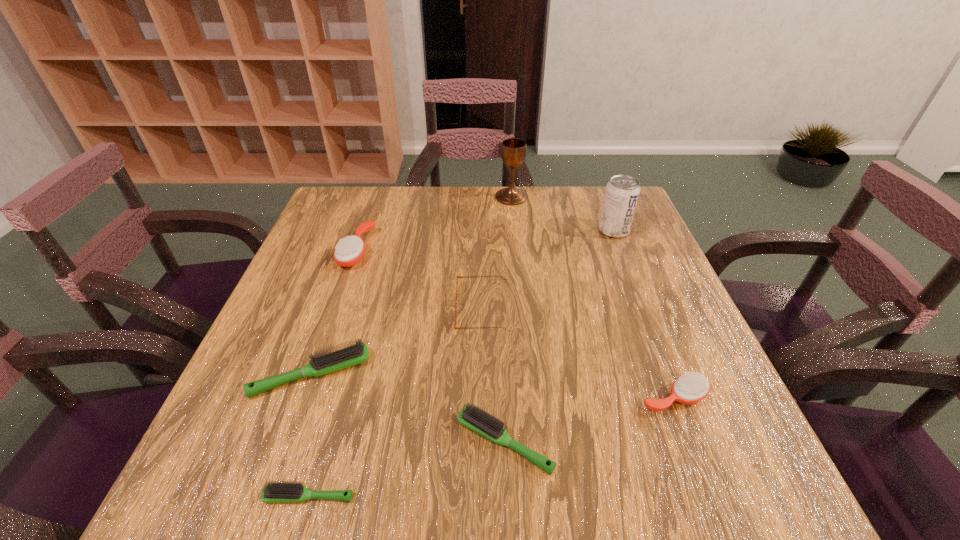
Locate an element on the screen. the farthest object is located at coordinates (513, 151).

At what (x,y) coordinates should I click in order to perform the action: click on the seventh shortest object. Please return your answer as a coordinate pair (x, y). This screenshot has width=960, height=540. Looking at the image, I should click on (622, 192).

Identify the location of the bigger orange hairbrush. (348, 251).

The image size is (960, 540). I want to click on the left orange hairbrush, so click(348, 251).

Locate an element on the screen. The width and height of the screenshot is (960, 540). sunglasses is located at coordinates click(x=503, y=278).

The height and width of the screenshot is (540, 960). What are the coordinates of `the farthest light hairbrush` in the screenshot? It's located at (358, 353).

I want to click on the rightmost hairbrush, so [x=690, y=388].

Locate an element on the screen. Image resolution: width=960 pixels, height=540 pixels. the smaller orange hairbrush is located at coordinates (690, 388).

Find the location of a particular element. The image size is (960, 540). the rightmost light hairbrush is located at coordinates [483, 423].

This screenshot has height=540, width=960. Identify the location of the second shortest object. (483, 423).